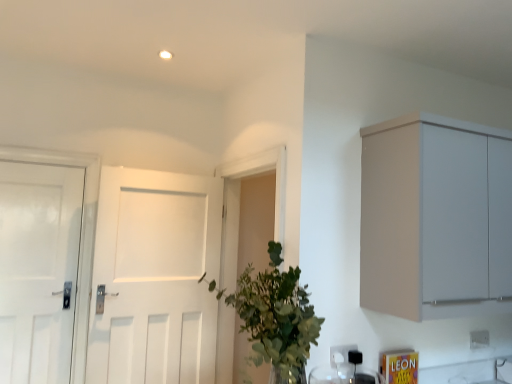
Question: From the image's perspective, would you say white plastic electric outlet at lower center, which is the 1th electric outlet from front to back, is shown under green leafy plant at center?

Choices:
 (A) yes
 (B) no

Answer: (A)

Question: Is the surface of white plastic electric outlet at lower center, the second electric outlet when ordered from right to left, in direct contact with green leafy plant at center?

Choices:
 (A) yes
 (B) no

Answer: (B)

Question: From the image's perspective, is white plastic electric outlet at lower center, the 2th electric outlet from the back, over green leafy plant at center?

Choices:
 (A) yes
 (B) no

Answer: (B)

Question: Does white plastic electric outlet at lower center, the 2th electric outlet from the back, come in front of green leafy plant at center?

Choices:
 (A) yes
 (B) no

Answer: (B)

Question: Considering the relative sizes of white plastic electric outlet at lower center, positioned as the first electric outlet in left-to-right order, and green leafy plant at center in the image provided, is white plastic electric outlet at lower center, positioned as the first electric outlet in left-to-right order, bigger than green leafy plant at center?

Choices:
 (A) no
 (B) yes

Answer: (A)

Question: From a real-world perspective, is white plastic electric outlet at lower right, which is counted as the first electric outlet, starting from the right, positioned above or below green leafy plant at center?

Choices:
 (A) above
 (B) below

Answer: (B)

Question: Is white plastic electric outlet at lower right, which is counted as the first electric outlet, starting from the right, to the left or to the right of green leafy plant at center in the image?

Choices:
 (A) right
 (B) left

Answer: (A)

Question: From the image's perspective, relative to green leafy plant at center, is white plastic electric outlet at lower right, marked as the second electric outlet in a front-to-back arrangement, above or below?

Choices:
 (A) below
 (B) above

Answer: (A)

Question: Considering their positions, is white plastic electric outlet at lower right, which is counted as the first electric outlet, starting from the right, located in front of or behind green leafy plant at center?

Choices:
 (A) front
 (B) behind

Answer: (B)

Question: In terms of size, does matte gray cabinet at upper right appear bigger or smaller than white plastic electric outlet at lower right, the 2th electric outlet positioned from the left?

Choices:
 (A) small
 (B) big

Answer: (B)

Question: Would you say matte gray cabinet at upper right is inside or outside white plastic electric outlet at lower right, the 2th electric outlet positioned from the left?

Choices:
 (A) inside
 (B) outside

Answer: (B)

Question: In the image, is matte gray cabinet at upper right positioned in front of or behind white plastic electric outlet at lower right, the 2th electric outlet positioned from the left?

Choices:
 (A) front
 (B) behind

Answer: (A)

Question: Considering the positions of matte gray cabinet at upper right and white plastic electric outlet at lower right, the 1th electric outlet in the back-to-front sequence, in the image, is matte gray cabinet at upper right wider or thinner than white plastic electric outlet at lower right, the 1th electric outlet in the back-to-front sequence,?

Choices:
 (A) wide
 (B) thin

Answer: (A)

Question: Considering the positions of green leafy plant at center and white matte door at center, the first door when ordered from right to left, in the image, is green leafy plant at center taller or shorter than white matte door at center, the first door when ordered from right to left,?

Choices:
 (A) short
 (B) tall

Answer: (A)

Question: Which is correct: green leafy plant at center is inside white matte door at center, the first door when ordered from right to left, or outside of it?

Choices:
 (A) inside
 (B) outside

Answer: (B)